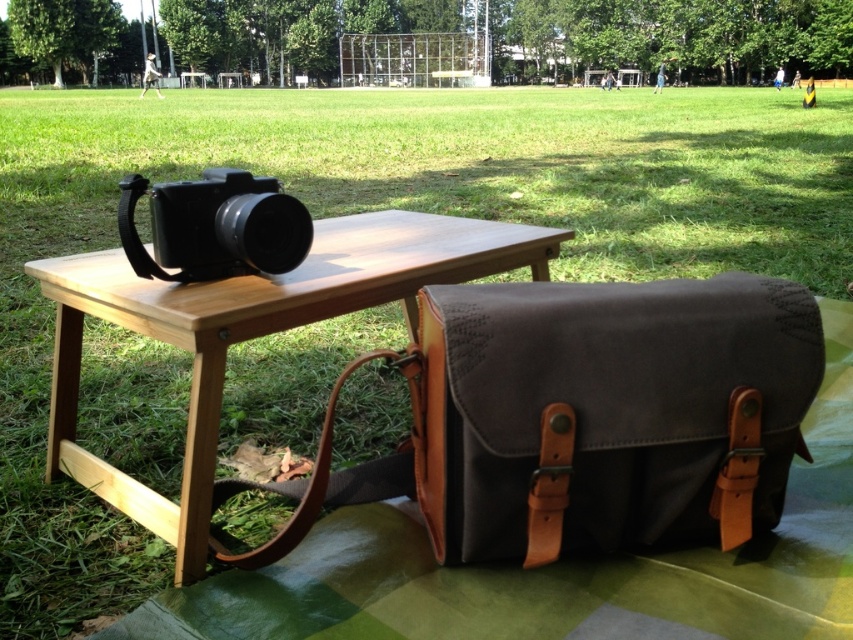
Question: Which point is closer to the camera?

Choices:
 (A) dark gray canvas bag at lower right
 (B) wooden table at center

Answer: (A)

Question: Is dark gray canvas bag at lower right bigger than wooden table at center?

Choices:
 (A) no
 (B) yes

Answer: (A)

Question: Is dark gray canvas bag at lower right to the left of wooden table at center from the viewer's perspective?

Choices:
 (A) no
 (B) yes

Answer: (A)

Question: Which object appears farthest from the camera in this image?

Choices:
 (A) dark gray canvas bag at lower right
 (B) wooden table at center

Answer: (B)

Question: Which object appears closest to the camera in this image?

Choices:
 (A) wooden table at center
 (B) dark gray canvas bag at lower right

Answer: (B)

Question: Can you confirm if dark gray canvas bag at lower right is wider than wooden table at center?

Choices:
 (A) no
 (B) yes

Answer: (A)